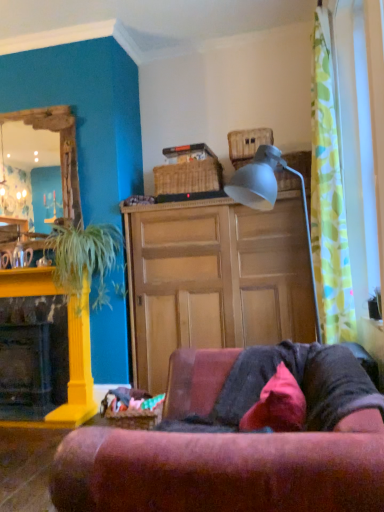
Question: From a real-world perspective, is green leafy plant at left physically located above or below velvet red couch at center?

Choices:
 (A) below
 (B) above

Answer: (B)

Question: From the image's perspective, is green leafy plant at left located above or below velvet red couch at center?

Choices:
 (A) above
 (B) below

Answer: (A)

Question: Which object is the farthest from the multicolored woven picnic basket at lower center, which is counted as the 1th picnic basket, starting from the left?

Choices:
 (A) yellow painted brick fireplace at left
 (B) green leafy plant at left
 (C) wooden mirror at left
 (D) velvet pink pillow at lower center
 (E) woven brown picnic basket at upper center, positioned as the 2th picnic basket in left-to-right order

Answer: (C)

Question: Estimate the real-world distances between objects in this image. Which object is farther from the woven brown picnic basket at upper center, the second picnic basket when ordered from bottom to top?

Choices:
 (A) woven brown picnic basket at upper center, the first picnic basket positioned from the top
 (B) velvet red couch at center
 (C) yellow painted brick fireplace at left
 (D) velvet pink pillow at lower center
 (E) multicolored woven picnic basket at lower center, which is counted as the 1th picnic basket, starting from the left

Answer: (D)